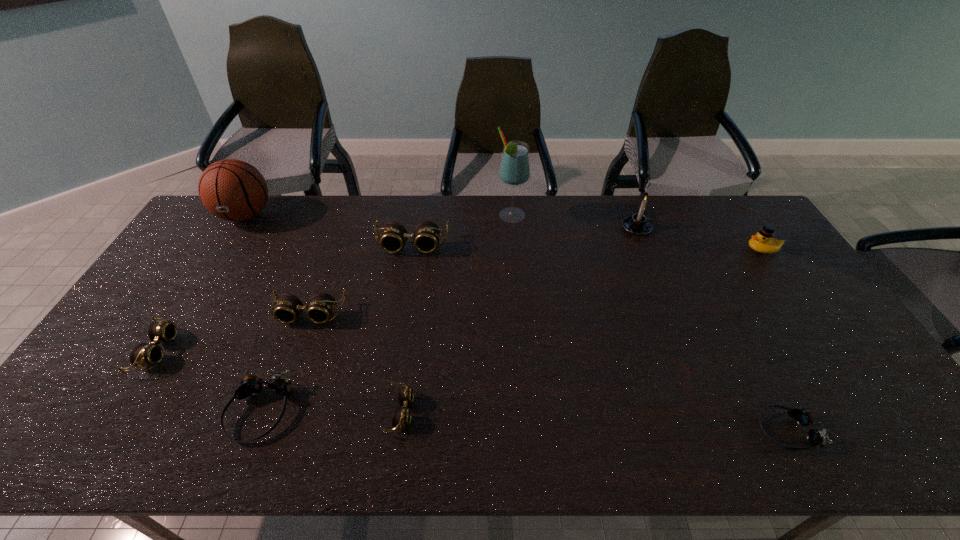
Image resolution: width=960 pixels, height=540 pixels. I want to click on empty space between the rightmost object and the biggest brown goggles, so click(x=588, y=248).

This screenshot has height=540, width=960. What are the coordinates of `empty space between the duck and the right bronze goggles` in the screenshot? It's located at (775, 340).

The width and height of the screenshot is (960, 540). In order to click on object identified as the closest to the yellow duck in this screenshot , I will do `click(638, 224)`.

The width and height of the screenshot is (960, 540). I want to click on object that is the fourth closest to the yellow duck, so click(426, 235).

Locate which goggles ranks second in proximity to the right bronze goggles. Please provide its 2D coordinates. Your answer should be formatted as a tuple, i.e. [(x, y)], where the tuple contains the x and y coordinates of a point satisfying the conditions above.

[(426, 235)]

Identify which goggles is the closest to the tallest object. Please provide its 2D coordinates. Your answer should be formatted as a tuple, i.e. [(x, y)], where the tuple contains the x and y coordinates of a point satisfying the conditions above.

[(426, 235)]

Locate which brown goggles is the fourth closest to the third tallest object. Please provide its 2D coordinates. Your answer should be formatted as a tuple, i.e. [(x, y)], where the tuple contains the x and y coordinates of a point satisfying the conditions above.

[(143, 354)]

Locate which brown goggles is the third closest to the rightmost goggles. Please provide its 2D coordinates. Your answer should be formatted as a tuple, i.e. [(x, y)], where the tuple contains the x and y coordinates of a point satisfying the conditions above.

[(321, 306)]

The width and height of the screenshot is (960, 540). Find the location of `vacant region that satisfies the following two spatial constraints: 1. on the front-facing side of the duck; 2. through the lenses of the sixth tallest object`. vacant region that satisfies the following two spatial constraints: 1. on the front-facing side of the duck; 2. through the lenses of the sixth tallest object is located at coordinates (807, 314).

I want to click on free spot that satisfies the following two spatial constraints: 1. on the front side of the fourth object from right to left; 2. through the lenses of the nearest brown goggles, so click(x=528, y=411).